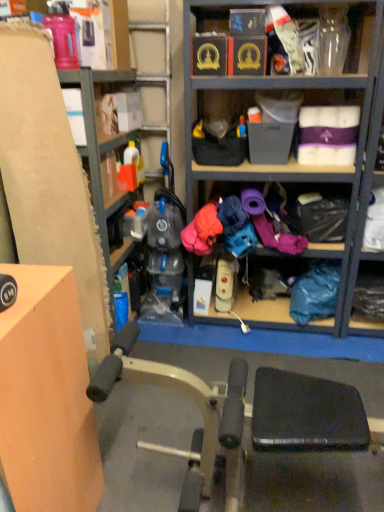
Image resolution: width=384 pixels, height=512 pixels. Describe the element at coordinates (47, 396) in the screenshot. I see `orange matte table at left` at that location.

Find the location of a particular element. The width and height of the screenshot is (384, 512). blue fabric bag at lower right is located at coordinates (315, 292).

Can you confirm if blue fabric bag at lower right is wider than orange matte table at left?

In fact, blue fabric bag at lower right might be narrower than orange matte table at left.

Is orange matte table at left inside blue fabric bag at lower right?

No, orange matte table at left is located outside of blue fabric bag at lower right.

Is blue fabric bag at lower right shorter than orange matte table at left?

Correct, blue fabric bag at lower right is not as tall as orange matte table at left.

From a real-world perspective, between blue fabric bag at lower right and orange matte table at left, who is vertically lower?

blue fabric bag at lower right.

Can you confirm if orange matte table at left is thinner than matte cardboard box at left?

Incorrect, the width of orange matte table at left is not less than that of matte cardboard box at left.

Does point (72, 400) appear closer or farther from the camera than point (95, 148)?

Point (72, 400).

Locate an element on the screen. The height and width of the screenshot is (512, 384). table in front of the matte cardboard box at left is located at coordinates (47, 396).

From a real-world perspective, is orange matte table at left beneath matte cardboard box at left?

Yes, from a real-world perspective, orange matte table at left is below matte cardboard box at left.

From a real-world perspective, is matte cardboard box at left above or below blue fabric bag at lower right?

matte cardboard box at left is situated higher than blue fabric bag at lower right in the real world.

Which object is further away from the camera, matte cardboard box at left or blue fabric bag at lower right?

blue fabric bag at lower right.

Is point (122, 64) farther from camera compared to point (329, 314)?

Yes, it is.

Measure the distance from matte cardboard box at left to blue fabric bag at lower right.

The distance of matte cardboard box at left from blue fabric bag at lower right is 4.17 feet.

Between blue fabric bag at lower right and matte cardboard box at left, which one has smaller width?

With smaller width is blue fabric bag at lower right.

Which object is more forward, blue fabric bag at lower right or matte cardboard box at left?

matte cardboard box at left is more forward.

Is blue fabric bag at lower right spatially inside matte cardboard box at left, or outside of it?

blue fabric bag at lower right exists outside the volume of matte cardboard box at left.

From a real-world perspective, between orange matte table at left and blue fabric bag at lower right, who is vertically lower?

blue fabric bag at lower right, from a real-world perspective.

Is point (44, 296) closer to camera compared to point (317, 302)?

Yes, it is in front of point (317, 302).

Can you confirm if orange matte table at left is thinner than blue fabric bag at lower right?

No, orange matte table at left is not thinner than blue fabric bag at lower right.

Who is more distant, orange matte table at left or blue fabric bag at lower right?

blue fabric bag at lower right.

Considering the relative sizes of matte cardboard box at left and orange matte table at left in the image provided, is matte cardboard box at left taller than orange matte table at left?

Correct, matte cardboard box at left is much taller as orange matte table at left.

From a real-world perspective, which is physically above, matte cardboard box at left or orange matte table at left?

From a 3D spatial view, matte cardboard box at left is above.

Is matte cardboard box at left positioned far away from orange matte table at left?

Yes.

Considering the relative sizes of matte cardboard box at left and orange matte table at left in the image provided, is matte cardboard box at left thinner than orange matte table at left?

Yes, matte cardboard box at left is thinner than orange matte table at left.

This screenshot has height=512, width=384. In order to click on table above the blue fabric bag at lower right (from a real-world perspective) in this screenshot , I will do `click(47, 396)`.

Locate an element on the screen. The height and width of the screenshot is (512, 384). table located on the left of matte cardboard box at left is located at coordinates (47, 396).

When comparing their distances from blue fabric bag at lower right, does orange matte table at left or matte cardboard box at left seem further?

Based on the image, orange matte table at left appears to be further to blue fabric bag at lower right.

From the image, which object appears to be nearer to matte cardboard box at left, orange matte table at left or blue fabric bag at lower right?

Among the two, orange matte table at left is located nearer to matte cardboard box at left.

Estimate the real-world distances between objects in this image. Which object is closer to orange matte table at left, blue fabric bag at lower right or matte cardboard box at left?

The object closer to orange matte table at left is matte cardboard box at left.

Based on their spatial positions, is matte cardboard box at left or orange matte table at left further from blue fabric bag at lower right?

Based on the image, orange matte table at left appears to be further to blue fabric bag at lower right.

Which object lies nearer to the anchor point orange matte table at left, matte cardboard box at left or blue fabric bag at lower right?

Based on the image, matte cardboard box at left appears to be nearer to orange matte table at left.

Based on their spatial positions, is blue fabric bag at lower right or orange matte table at left further from matte cardboard box at left?

blue fabric bag at lower right is positioned further to the anchor matte cardboard box at left.

Locate an element on the screen. The width and height of the screenshot is (384, 512). shelf between orange matte table at left and blue fabric bag at lower right from left to right is located at coordinates pos(121,82).